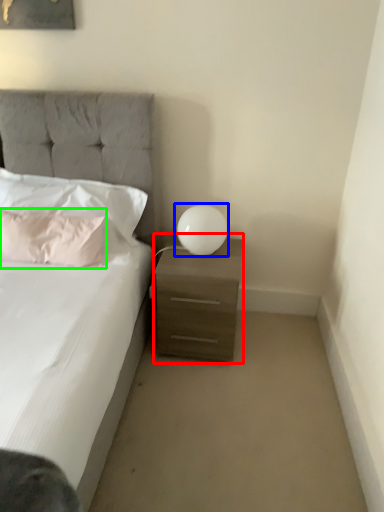
Question: Based on their relative distances, which object is nearer to nightstand (highlighted by a red box)? Choose from table lamp (highlighted by a blue box) and pillow (highlighted by a green box).

Choices:
 (A) table lamp
 (B) pillow

Answer: (A)